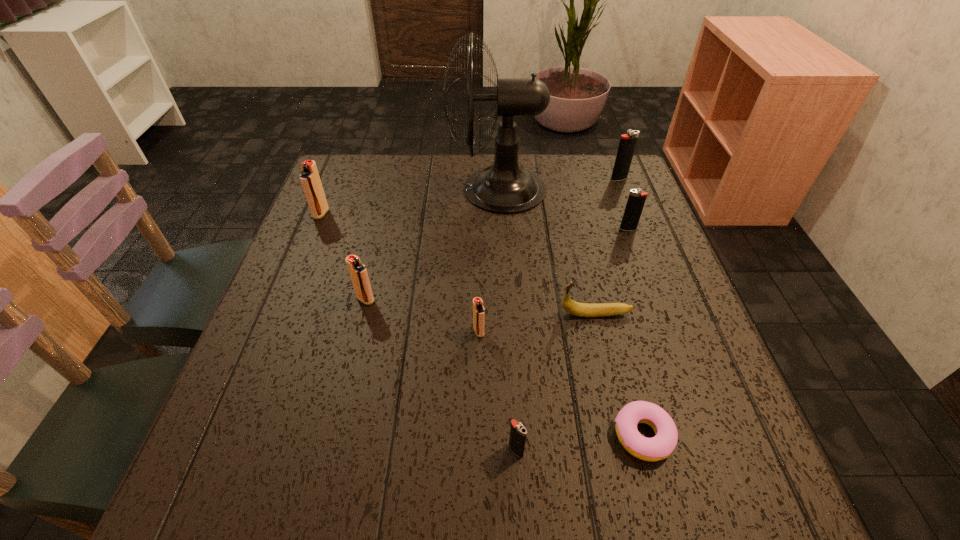
Locate an element on the screen. The height and width of the screenshot is (540, 960). free spot between the seventh farthest object and the farthest black igniter is located at coordinates (549, 255).

Locate an element on the screen. The height and width of the screenshot is (540, 960). empty space between the third farthest igniter and the smallest black igniter is located at coordinates (572, 340).

The height and width of the screenshot is (540, 960). I want to click on blank region between the third nearest object and the banana, so click(x=538, y=322).

Where is `vacant area that lies between the shortest object and the smallest red igniter`? The image size is (960, 540). vacant area that lies between the shortest object and the smallest red igniter is located at coordinates (561, 383).

Identify which object is the fourth nearest to the pink doughnut. Please provide its 2D coordinates. Your answer should be formatted as a tuple, i.e. [(x, y)], where the tuple contains the x and y coordinates of a point satisfying the conditions above.

[(636, 200)]

Locate which object is the eighth closest to the doughnut. Please provide its 2D coordinates. Your answer should be formatted as a tuple, i.e. [(x, y)], where the tuple contains the x and y coordinates of a point satisfying the conditions above.

[(310, 180)]

Locate which igniter ranks fifth in proximity to the fan. Please provide its 2D coordinates. Your answer should be formatted as a tuple, i.e. [(x, y)], where the tuple contains the x and y coordinates of a point satisfying the conditions above.

[(478, 309)]

I want to click on igniter that is the fourth closest one to the tallest object, so click(x=310, y=180).

Identify the location of the third closest red igniter to the pink doughnut. (310, 180).

At what (x,y) coordinates should I click in order to perform the action: click on the second closest red igniter relative to the leftmost object. Please return your answer as a coordinate pair (x, y). Looking at the image, I should click on (478, 309).